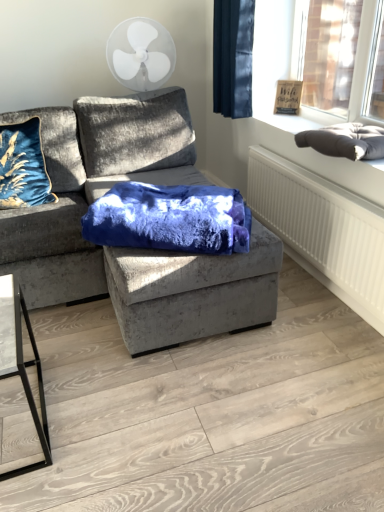
Question: Is white textured radiator at lower right at the back of velvet blue blanket at center?

Choices:
 (A) yes
 (B) no

Answer: (B)

Question: Is velvet blue blanket at center at the left side of white textured radiator at lower right?

Choices:
 (A) no
 (B) yes

Answer: (B)

Question: Does velvet blue blanket at center have a larger size compared to white textured radiator at lower right?

Choices:
 (A) yes
 (B) no

Answer: (A)

Question: Does velvet blue blanket at center come in front of white textured radiator at lower right?

Choices:
 (A) yes
 (B) no

Answer: (A)

Question: Would you consider velvet blue blanket at center to be distant from white textured radiator at lower right?

Choices:
 (A) yes
 (B) no

Answer: (B)

Question: Looking at the image, does matte brown wooden picture frame at upper right seem bigger or smaller compared to dark gray cushion at upper right?

Choices:
 (A) small
 (B) big

Answer: (A)

Question: In terms of width, does matte brown wooden picture frame at upper right look wider or thinner when compared to dark gray cushion at upper right?

Choices:
 (A) wide
 (B) thin

Answer: (B)

Question: Considering the relative positions of matte brown wooden picture frame at upper right and dark gray cushion at upper right in the image provided, is matte brown wooden picture frame at upper right to the left or to the right of dark gray cushion at upper right?

Choices:
 (A) right
 (B) left

Answer: (B)

Question: Is matte brown wooden picture frame at upper right in front of or behind dark gray cushion at upper right in the image?

Choices:
 (A) behind
 (B) front

Answer: (A)

Question: From the image's perspective, is dark gray cushion at upper right located above or below white plastic fan at upper center?

Choices:
 (A) above
 (B) below

Answer: (B)

Question: Looking at their shapes, would you say dark gray cushion at upper right is wider or thinner than white plastic fan at upper center?

Choices:
 (A) wide
 (B) thin

Answer: (B)

Question: Is dark gray cushion at upper right taller or shorter than white plastic fan at upper center?

Choices:
 (A) tall
 (B) short

Answer: (B)

Question: Based on their positions, is dark gray cushion at upper right located to the left or right of white plastic fan at upper center?

Choices:
 (A) right
 (B) left

Answer: (A)

Question: From a real-world perspective, is velvet gray couch at center above or below dark blue velvet curtain at upper right?

Choices:
 (A) below
 (B) above

Answer: (A)

Question: Is velvet gray couch at center bigger or smaller than dark blue velvet curtain at upper right?

Choices:
 (A) big
 (B) small

Answer: (A)